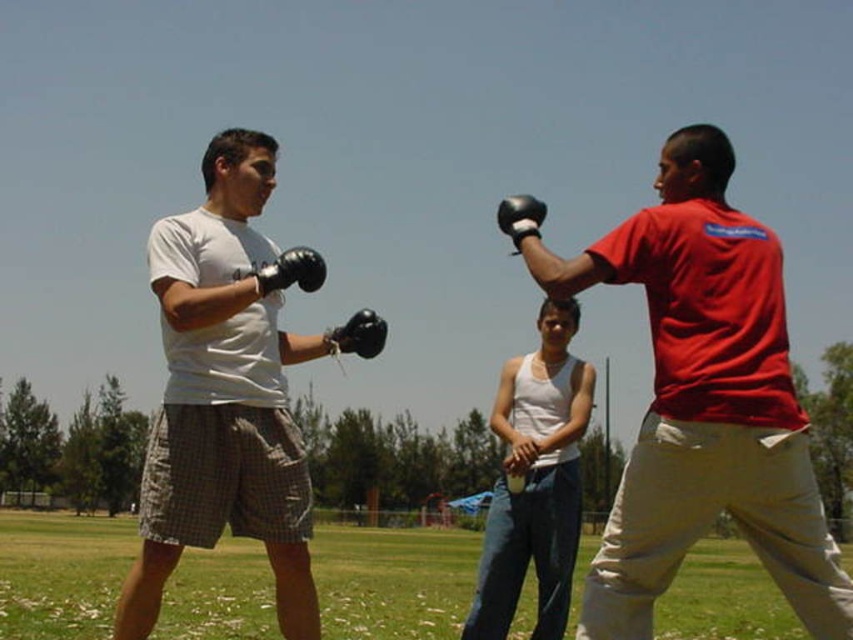
Question: Can you confirm if matte black boxing glove at upper right is thinner than black matte boxing glove at upper right?

Choices:
 (A) no
 (B) yes

Answer: (A)

Question: Among these points, which one is farthest from the camera?

Choices:
 (A) (546, 538)
 (B) (773, 365)
 (C) (497, 209)
 (D) (374, 344)

Answer: (C)

Question: Which object is the closest to the black matte boxing glove at center?

Choices:
 (A) black matte boxing glove at left
 (B) white matte t-shirt at center

Answer: (A)

Question: Where is white tank top at center located in relation to black matte boxing glove at center in the image?

Choices:
 (A) below
 (B) above

Answer: (A)

Question: Which of the following is the closest to the observer?

Choices:
 (A) matte black boxing glove at upper right
 (B) white matte t-shirt at center

Answer: (A)

Question: Is white matte t-shirt at center closer to camera compared to black matte boxing glove at center?

Choices:
 (A) no
 (B) yes

Answer: (B)